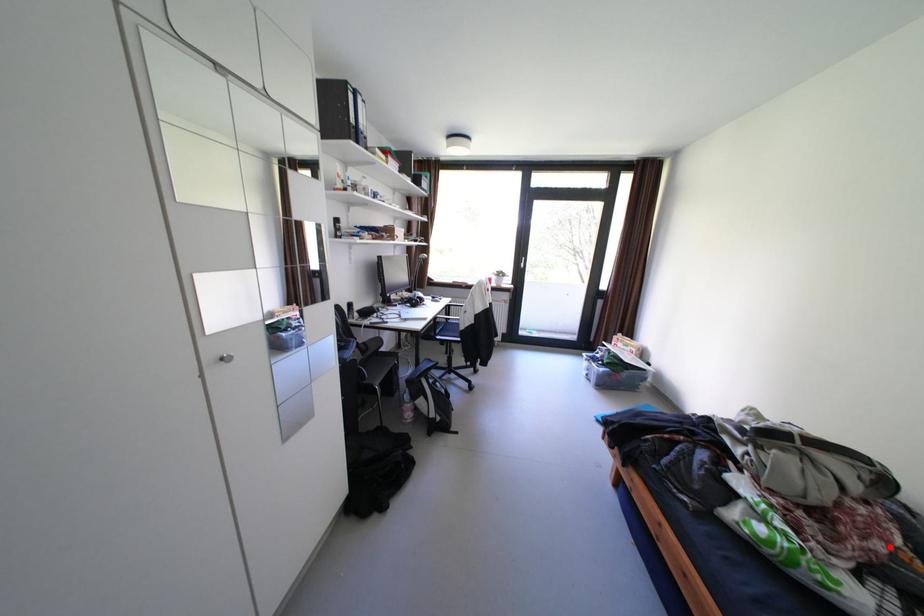
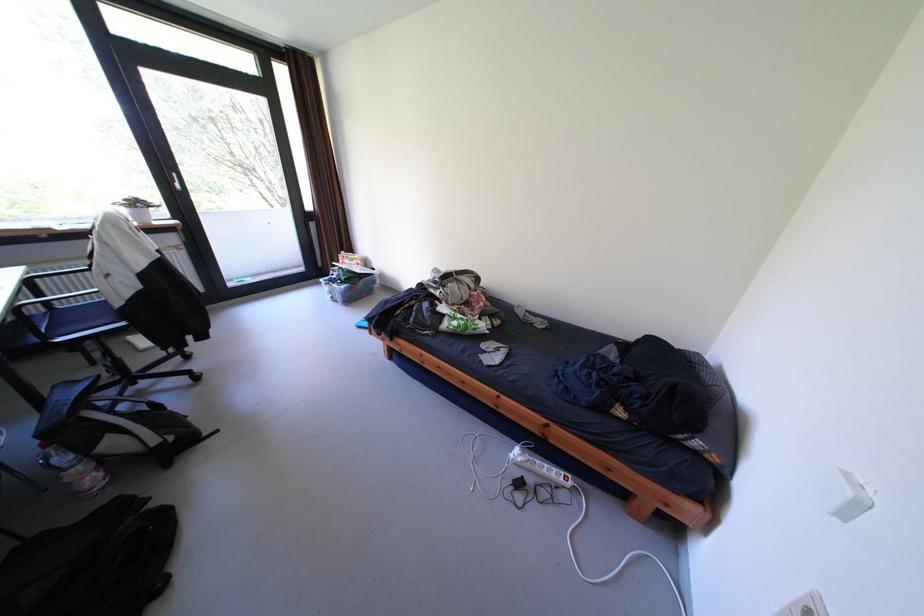
Where in the second image is the point corresponding to the highlighted location from the first image?

(492, 304)